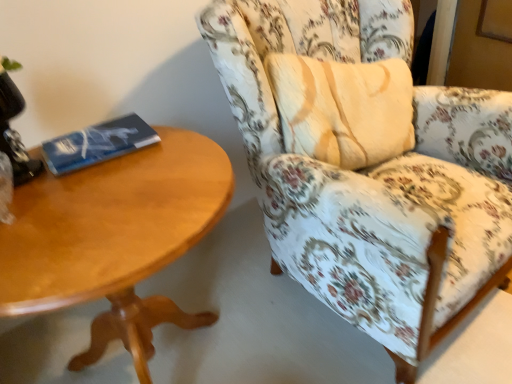
Question: From the image's perspective, is black glass table lamp at upper left above or below light brown wood coffee table at left?

Choices:
 (A) below
 (B) above

Answer: (B)

Question: From a real-world perspective, relative to light brown wood coffee table at left, is black glass table lamp at upper left vertically above or below?

Choices:
 (A) below
 (B) above

Answer: (B)

Question: Estimate the real-world distances between objects in this image. Which object is closer to the blue matte paperback book at left?

Choices:
 (A) black glass table lamp at upper left
 (B) floral fabric chair at right
 (C) light brown wood coffee table at left

Answer: (A)

Question: Which object is the farthest from the blue matte paperback book at left?

Choices:
 (A) light brown wood coffee table at left
 (B) floral fabric chair at right
 (C) black glass table lamp at upper left

Answer: (B)